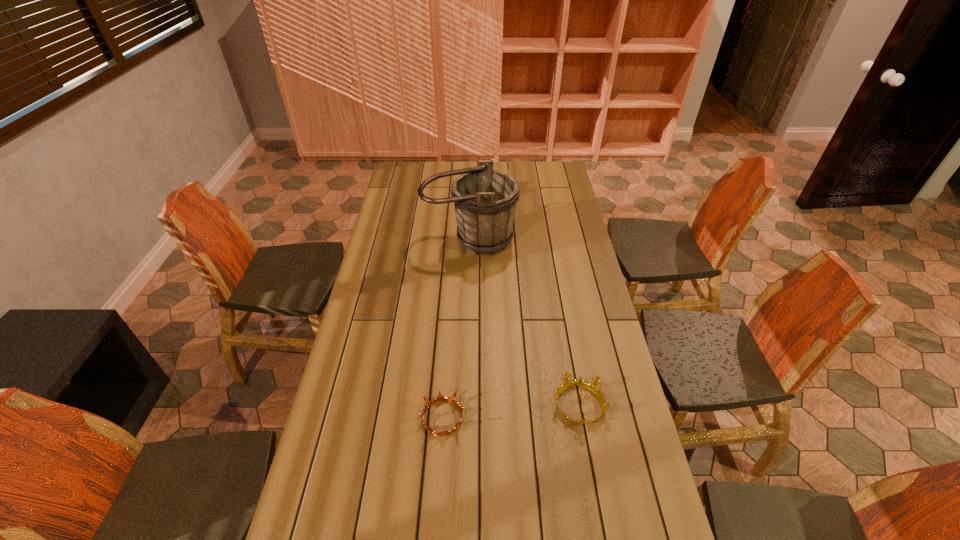
Where is `free space between the leftmost crown and the second farthest object`? The height and width of the screenshot is (540, 960). free space between the leftmost crown and the second farthest object is located at coordinates (456, 328).

You are a GUI agent. You are given a task and a screenshot of the screen. Output one action in this format:
    pyautogui.click(x=<x>, y=<y>)
    Task: Click on the blank region between the rightmost crown and the third nearest object
    This screenshot has width=960, height=540.
    Given the screenshot: What is the action you would take?
    pyautogui.click(x=524, y=322)

Find the location of `vacant point located between the second farthest object and the leftmost crown`. vacant point located between the second farthest object and the leftmost crown is located at coordinates (456, 328).

Image resolution: width=960 pixels, height=540 pixels. Find the location of `vacant area between the leftmost crown and the tallest object`. vacant area between the leftmost crown and the tallest object is located at coordinates (456, 328).

Image resolution: width=960 pixels, height=540 pixels. Find the location of `free space between the bucket and the rightmost crown`. free space between the bucket and the rightmost crown is located at coordinates (524, 322).

Where is `unoccupied position between the leftmost crown and the farthest crown`? Image resolution: width=960 pixels, height=540 pixels. unoccupied position between the leftmost crown and the farthest crown is located at coordinates (472, 305).

Image resolution: width=960 pixels, height=540 pixels. In order to click on vacant space in between the rightmost object and the leftmost crown in this screenshot , I will do `click(511, 411)`.

Identify which object is the second nearest to the rightmost crown. Please provide its 2D coordinates. Your answer should be formatted as a tuple, i.e. [(x, y)], where the tuple contains the x and y coordinates of a point satisfying the conditions above.

[(485, 200)]

At what (x,y) coordinates should I click in order to perform the action: click on object that can be found as the second closest to the tallest object. Please return your answer as a coordinate pair (x, y). This screenshot has height=540, width=960. Looking at the image, I should click on (592, 387).

The image size is (960, 540). Find the location of `crown that can be found as the closest to the rightmost object`. crown that can be found as the closest to the rightmost object is located at coordinates point(440,397).